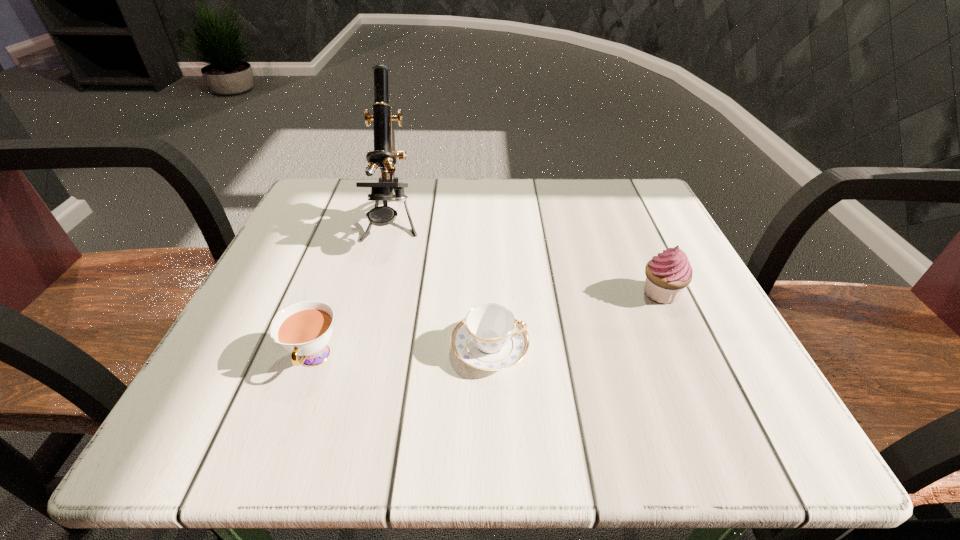
Locate an element on the screen. The height and width of the screenshot is (540, 960). free space located on the side of the taller teacup with the handle is located at coordinates (293, 418).

At what (x,y) coordinates should I click in order to perform the action: click on vacant region located 0.320m on the side with the handle of the shortest object. Please return your answer as a coordinate pair (x, y). The height and width of the screenshot is (540, 960). Looking at the image, I should click on (736, 348).

Find the location of `object that is at the far edge`. object that is at the far edge is located at coordinates (384, 155).

Find the location of a particular element. The width and height of the screenshot is (960, 540). microscope that is at the left edge is located at coordinates (384, 155).

This screenshot has width=960, height=540. Find the location of `teacup present at the left edge`. teacup present at the left edge is located at coordinates (304, 328).

In order to click on object at the right edge in this screenshot , I will do `click(667, 274)`.

Identify the location of object that is at the far left corner. (384, 155).

What are the coordinates of `free region at the far edge of the desktop` in the screenshot? It's located at (524, 184).

Locate an element on the screen. blank area at the near edge is located at coordinates (547, 433).

The image size is (960, 540). I want to click on vacant space at the left edge of the desktop, so click(x=246, y=323).